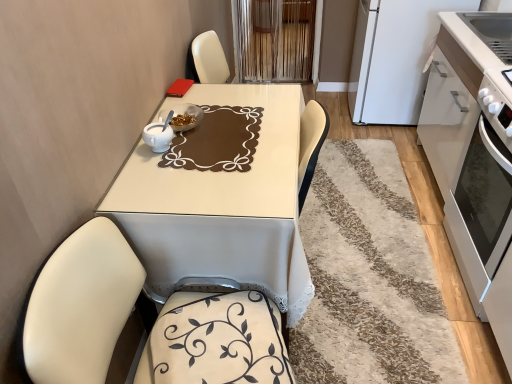
Question: Does white matte cabinet at right appear on the right side of white glossy bowl at center?

Choices:
 (A) yes
 (B) no

Answer: (A)

Question: Considering the relative positions of white matte cabinet at right and white glossy bowl at center in the image provided, is white matte cabinet at right to the left of white glossy bowl at center from the viewer's perspective?

Choices:
 (A) no
 (B) yes

Answer: (A)

Question: From the image's perspective, is white matte cabinet at right above white glossy bowl at center?

Choices:
 (A) no
 (B) yes

Answer: (B)

Question: From the image's perspective, is white matte cabinet at right beneath white glossy bowl at center?

Choices:
 (A) no
 (B) yes

Answer: (A)

Question: Would you say white matte cabinet at right is outside white glossy bowl at center?

Choices:
 (A) yes
 (B) no

Answer: (A)

Question: Is white matte cabinet at right positioned with its back to white glossy bowl at center?

Choices:
 (A) no
 (B) yes

Answer: (A)

Question: Can you confirm if white glossy oven at right is taller than white matte refrigerator at upper right?

Choices:
 (A) no
 (B) yes

Answer: (A)

Question: Does white glossy oven at right come in front of white matte refrigerator at upper right?

Choices:
 (A) yes
 (B) no

Answer: (A)

Question: Considering the relative sizes of white glossy oven at right and white matte refrigerator at upper right in the image provided, is white glossy oven at right shorter than white matte refrigerator at upper right?

Choices:
 (A) no
 (B) yes

Answer: (B)

Question: Is white matte refrigerator at upper right at the back of white glossy oven at right?

Choices:
 (A) yes
 (B) no

Answer: (B)

Question: From the image's perspective, is white glossy oven at right below white matte refrigerator at upper right?

Choices:
 (A) no
 (B) yes

Answer: (B)

Question: From the image's perspective, is white glossy oven at right located above white matte refrigerator at upper right?

Choices:
 (A) no
 (B) yes

Answer: (A)

Question: Can you confirm if white shaggy rug at center is positioned to the left of white glossy oven at right?

Choices:
 (A) yes
 (B) no

Answer: (A)